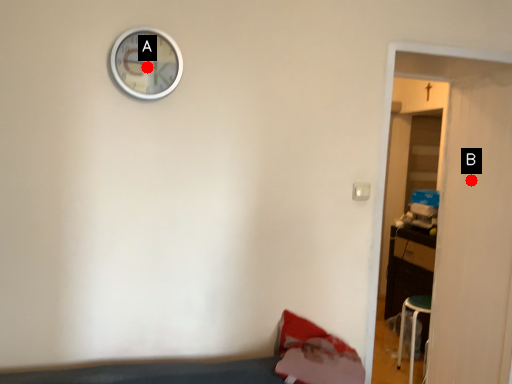
Question: Two points are circled on the image, labeled by A and B beside each circle. Which point appears farthest from the camera in this image?

Choices:
 (A) A is further
 (B) B is further

Answer: (B)